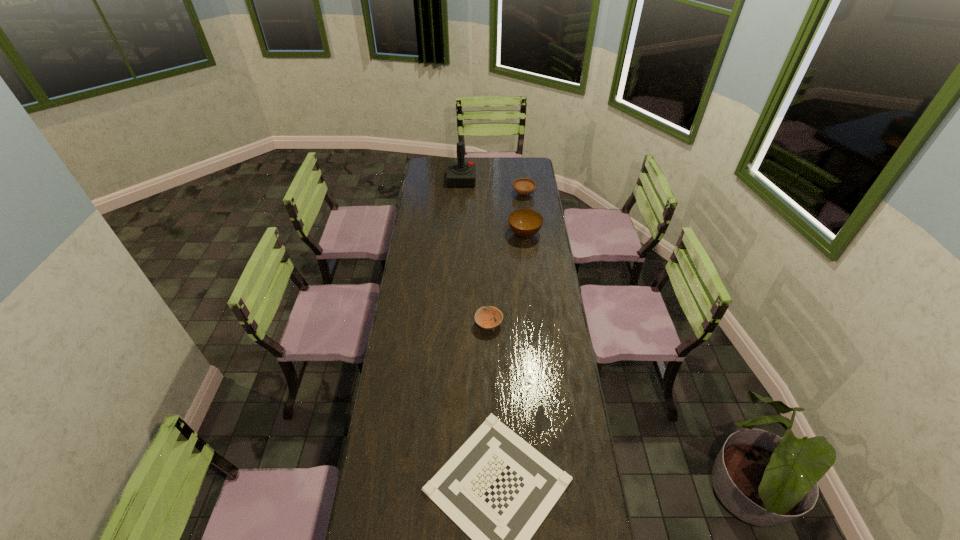
Locate an element on the screen. vacant space in between the tallest object and the fourth shortest object is located at coordinates pos(493,207).

Where is `vacant space that is in between the second nearest object and the second tallest object`? The height and width of the screenshot is (540, 960). vacant space that is in between the second nearest object and the second tallest object is located at coordinates (507, 279).

The height and width of the screenshot is (540, 960). I want to click on object that ranks as the closest to the fourth tallest object, so click(497, 488).

Locate an element on the screen. object that is the fourth closest to the second tallest bowl is located at coordinates coord(497,488).

This screenshot has width=960, height=540. In order to click on bowl that stands as the second closest to the shortest object in this screenshot , I will do `click(525, 223)`.

What are the coordinates of `the closest bowl relative to the farthest bowl` in the screenshot? It's located at (525, 223).

Where is `free point that satisfies the following two spatial constraints: 1. on the back side of the nearest bowl; 2. on the base of the tallest object`? The height and width of the screenshot is (540, 960). free point that satisfies the following two spatial constraints: 1. on the back side of the nearest bowl; 2. on the base of the tallest object is located at coordinates (486, 180).

At what (x,y) coordinates should I click in order to perform the action: click on vacant position in the image that satisfies the following two spatial constraints: 1. on the back side of the second farthest bowl; 2. on the right side of the third tallest object. Please return your answer as a coordinate pair (x, y). The image size is (960, 540). Looking at the image, I should click on (x=520, y=194).

The height and width of the screenshot is (540, 960). Find the location of `vacant point that satisfies the following two spatial constraints: 1. on the back side of the tallest bowl; 2. on the right side of the leftmost bowl`. vacant point that satisfies the following two spatial constraints: 1. on the back side of the tallest bowl; 2. on the right side of the leftmost bowl is located at coordinates click(487, 234).

At what (x,y) coordinates should I click in order to perform the action: click on vacant region that satisfies the following two spatial constraints: 1. on the base of the joystick; 2. on the left side of the third farthest object. Please return your answer as a coordinate pair (x, y). This screenshot has width=960, height=540. Looking at the image, I should click on (459, 234).